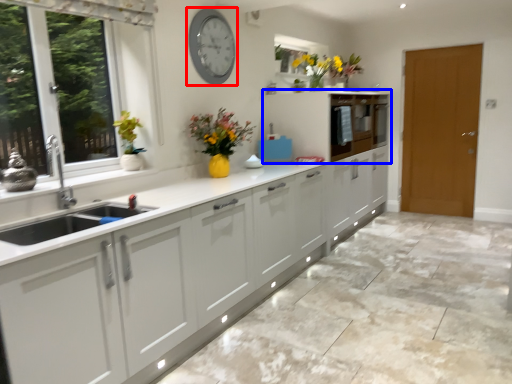
Question: Which of the following is the closest to the observer, clock (highlighted by a red box) or cabinetry (highlighted by a blue box)?

Choices:
 (A) clock
 (B) cabinetry

Answer: (A)